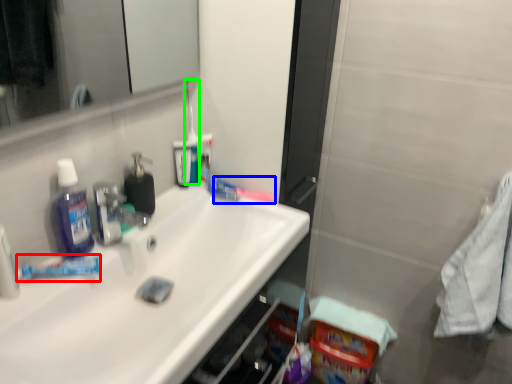
Question: Which object is positioned farthest from toothpaste (highlighted by a red box)? Select from toothbrush (highlighted by a blue box) and toothbrush (highlighted by a green box).

Choices:
 (A) toothbrush
 (B) toothbrush

Answer: (A)